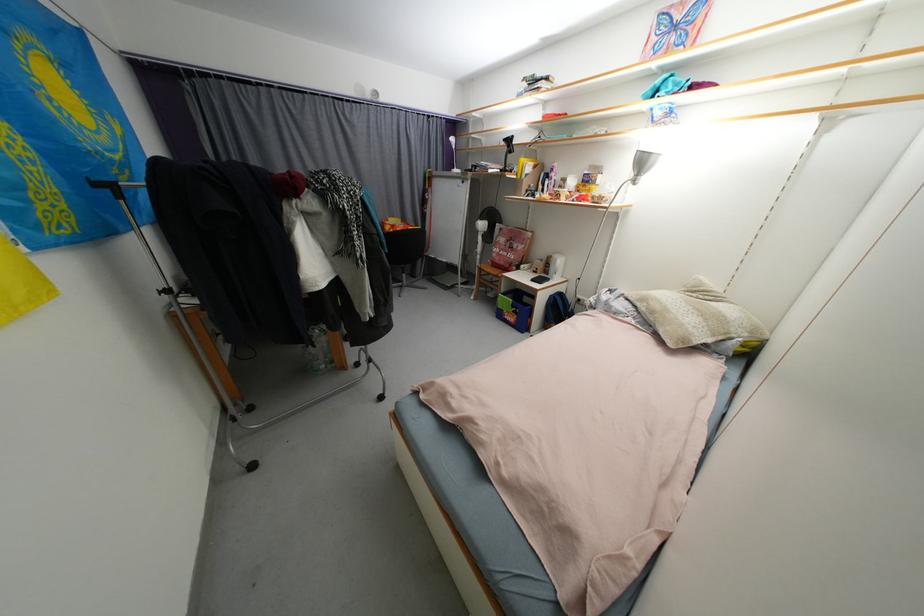
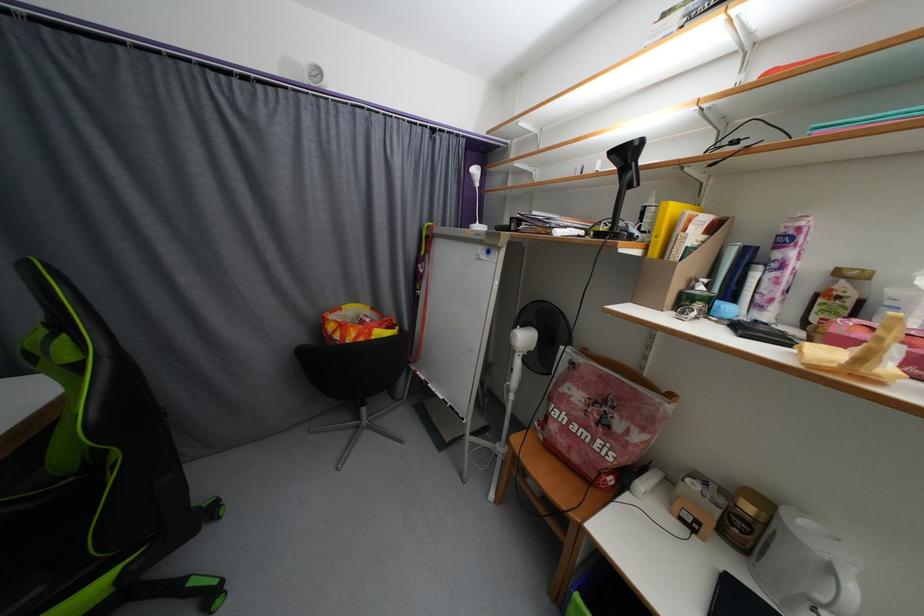
Question: What movement of the cameraman would produce the second image?

Choices:
 (A) Left
 (B) Right
 (C) Forward
 (D) Backward

Answer: (C)